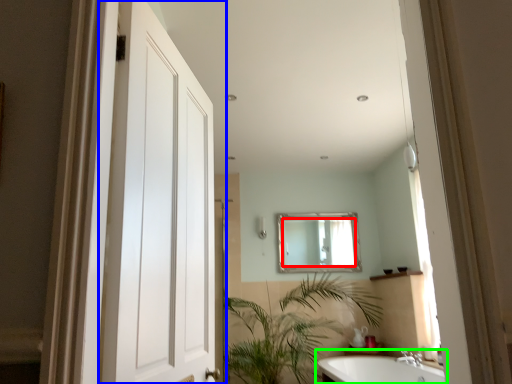
Question: Estimate the real-world distances between objects in this image. Which object is farther from mirror (highlighted by a red box), door (highlighted by a blue box) or bathtub (highlighted by a green box)?

Choices:
 (A) door
 (B) bathtub

Answer: (A)